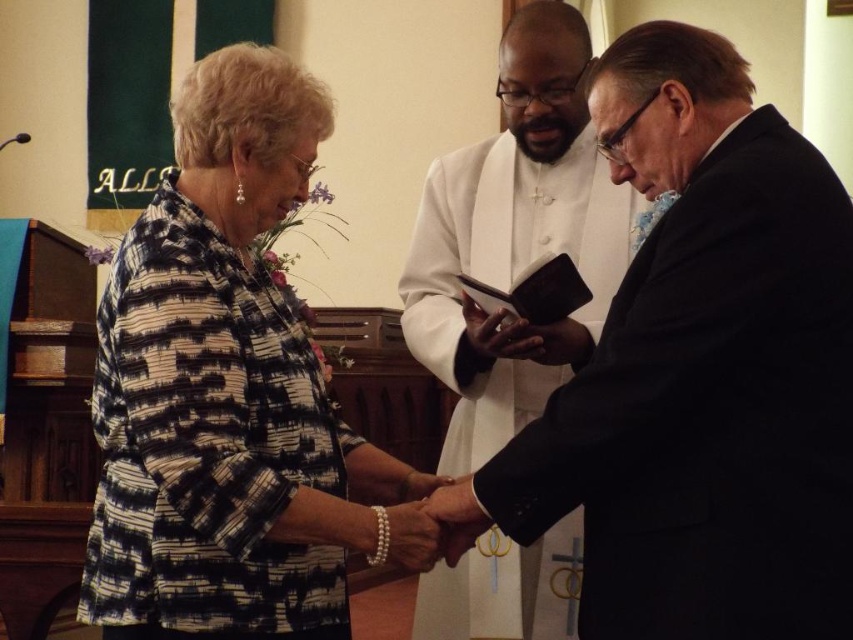
Does point (755, 273) lie in front of point (120, 241)?

Yes, it is in front of point (120, 241).

Which is behind, point (753, 577) or point (312, 596)?

Point (312, 596)

Identify the location of black matte suit at center. (699, 372).